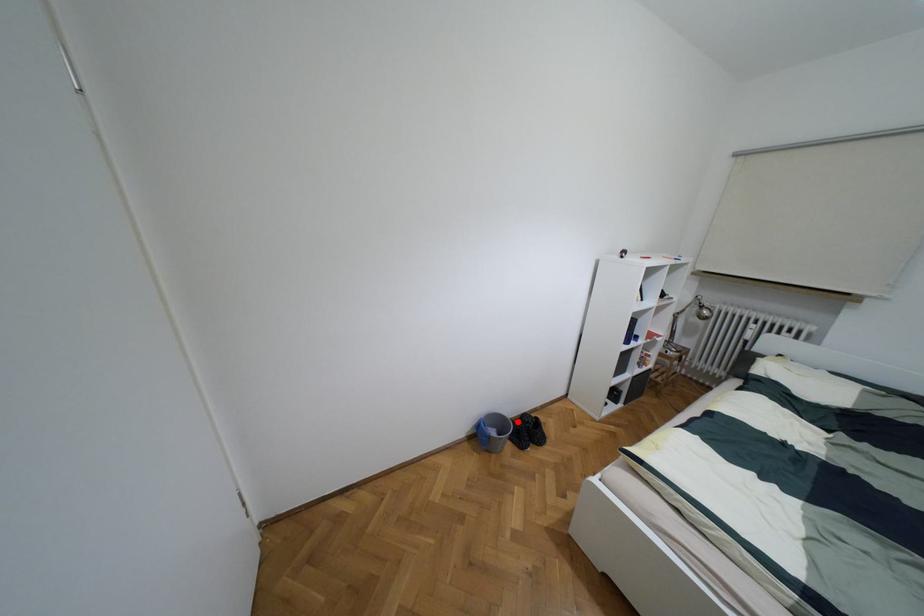
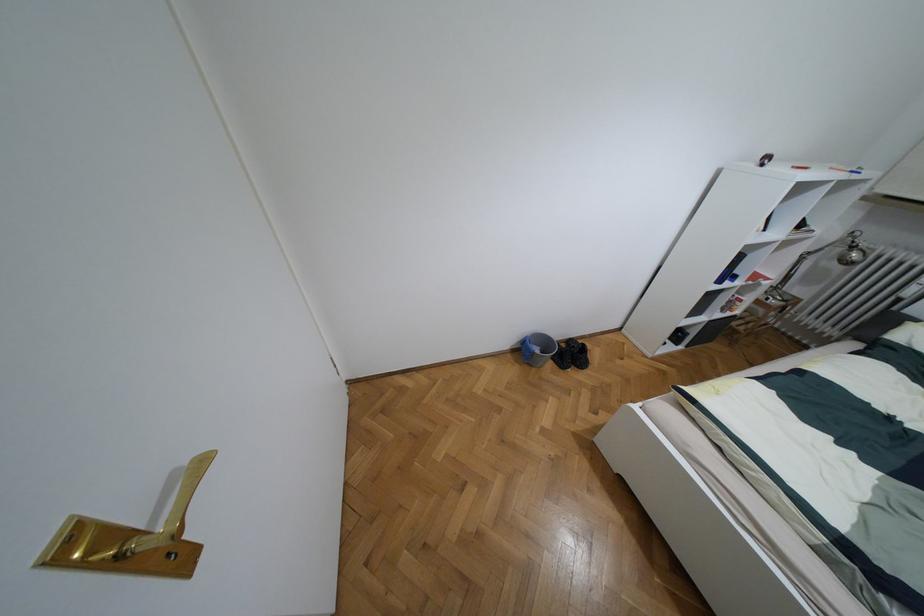
In the second image, find the point that corresponds to the highlighted location in the first image.

(563, 345)